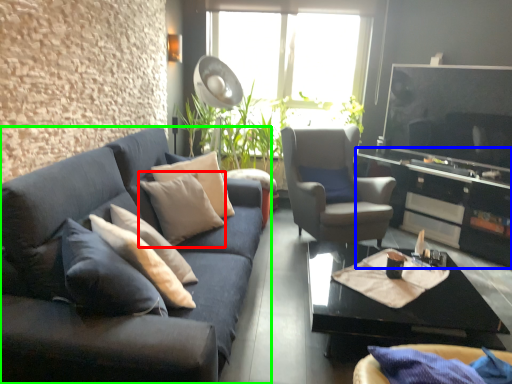
Question: Which object is positioned farthest from pillow (highlighted by a red box)? Select from entertainment center (highlighted by a blue box) and studio couch (highlighted by a green box).

Choices:
 (A) entertainment center
 (B) studio couch

Answer: (A)